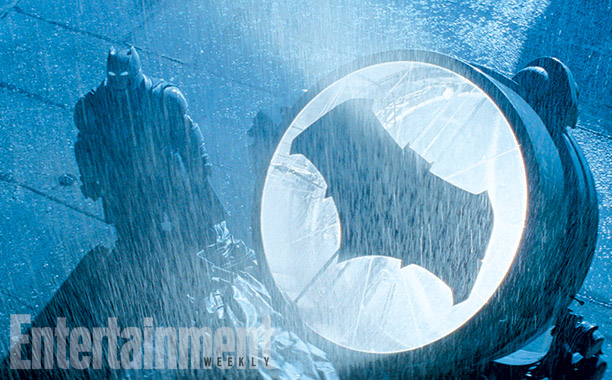
Locate an element on the screen. The height and width of the screenshot is (380, 612). circular light is located at coordinates point(543,149).